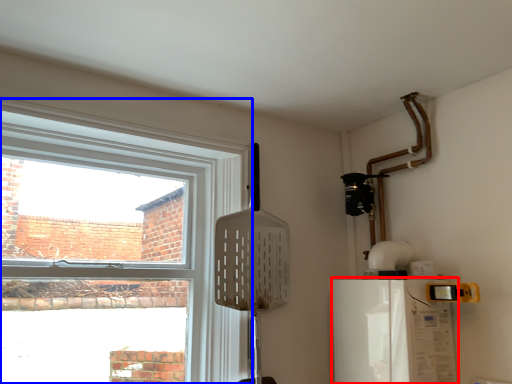
Question: Which of the following is the farthest to the observer, appliance (highlighted by a red box) or window (highlighted by a blue box)?

Choices:
 (A) appliance
 (B) window

Answer: (A)